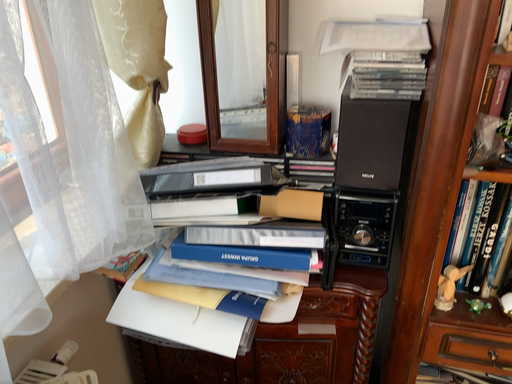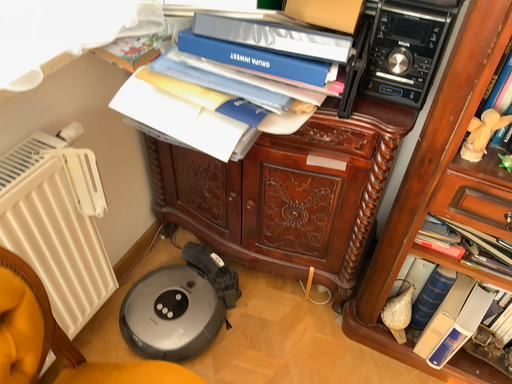
Question: Which way did the camera rotate in the video?

Choices:
 (A) rotated downward
 (B) rotated upward

Answer: (A)